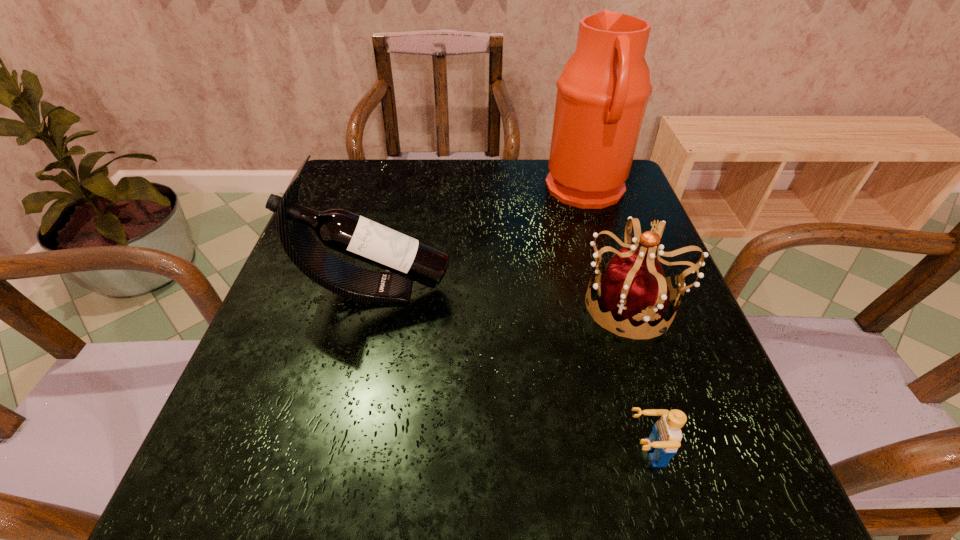
Where is `vacant space in between the third shortest object and the third tallest object`? vacant space in between the third shortest object and the third tallest object is located at coordinates (504, 297).

Where is `vacant space that's between the tiara and the leftmost object`? Image resolution: width=960 pixels, height=540 pixels. vacant space that's between the tiara and the leftmost object is located at coordinates (504, 297).

You are a GUI agent. You are given a task and a screenshot of the screen. Output one action in this format:
    pyautogui.click(x=<x>, y=<y>)
    Task: Click on the empty space between the leftmost object and the tallest object
    The width and height of the screenshot is (960, 540).
    Given the screenshot: What is the action you would take?
    pyautogui.click(x=481, y=240)

You are a GUI agent. You are given a task and a screenshot of the screen. Output one action in this format:
    pyautogui.click(x=<x>, y=<y>)
    Task: Click on the free space between the third tallest object and the nearest object
    The image size is (960, 540).
    Given the screenshot: What is the action you would take?
    pyautogui.click(x=639, y=379)

The width and height of the screenshot is (960, 540). What are the coordinates of `the third closest object to the wine bottle` in the screenshot? It's located at 664,440.

Find the location of `object that is the third nearest to the nearest object`. object that is the third nearest to the nearest object is located at coordinates (603, 91).